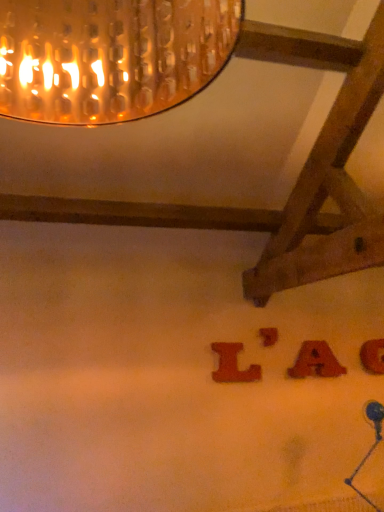
Question: Is wooden letter at center, which appears as the 2th alphabet when viewed from the left, with wooden letter l at center, which ranks as the 1th alphabet in left-to-right order?

Choices:
 (A) yes
 (B) no

Answer: (B)

Question: Is wooden letter at center, which appears as the 2th alphabet when viewed from the left, taller than wooden letter l at center, the 4th alphabet in the right-to-left sequence?

Choices:
 (A) no
 (B) yes

Answer: (A)

Question: Does wooden letter at center, the 3th alphabet positioned from the right, lie in front of wooden letter l at center, which ranks as the 1th alphabet in left-to-right order?

Choices:
 (A) no
 (B) yes

Answer: (A)

Question: Can you confirm if wooden letter at center, which appears as the 2th alphabet when viewed from the left, is positioned to the left of wooden letter l at center, which ranks as the 1th alphabet in left-to-right order?

Choices:
 (A) no
 (B) yes

Answer: (A)

Question: From the image's perspective, does wooden letter at center, the 3th alphabet positioned from the right, appear lower than wooden letter l at center, which ranks as the 1th alphabet in left-to-right order?

Choices:
 (A) yes
 (B) no

Answer: (B)

Question: In terms of width, does wooden letter at lower right, the 1th alphabet from the right, look wider or thinner when compared to wooden letter at center, the 3th alphabet positioned from the right?

Choices:
 (A) thin
 (B) wide

Answer: (B)

Question: Visually, is wooden letter at lower right, the 1th alphabet from the right, positioned to the left or to the right of wooden letter at center, the 3th alphabet positioned from the right?

Choices:
 (A) right
 (B) left

Answer: (A)

Question: Considering the positions of wooden letter at lower right, the 1th alphabet from the right, and wooden letter at center, the 3th alphabet positioned from the right, in the image, is wooden letter at lower right, the 1th alphabet from the right, bigger or smaller than wooden letter at center, the 3th alphabet positioned from the right,?

Choices:
 (A) big
 (B) small

Answer: (A)

Question: From the image's perspective, is wooden letter at lower right, the 1th alphabet from the right, located above or below wooden letter at center, which appears as the 2th alphabet when viewed from the left?

Choices:
 (A) above
 (B) below

Answer: (B)

Question: Is wooden letter at center, the 3th alphabet positioned from the right, wider or thinner than wooden letter at lower right, the 1th alphabet from the right?

Choices:
 (A) thin
 (B) wide

Answer: (A)

Question: Is wooden letter at center, the 3th alphabet positioned from the right, bigger or smaller than wooden letter at lower right, the 4th alphabet when ordered from left to right?

Choices:
 (A) big
 (B) small

Answer: (B)

Question: From the image's perspective, is wooden letter at center, the 3th alphabet positioned from the right, located above or below wooden letter at lower right, the 4th alphabet when ordered from left to right?

Choices:
 (A) above
 (B) below

Answer: (A)

Question: Is point (273, 344) closer or farther from the camera than point (375, 360)?

Choices:
 (A) farther
 (B) closer

Answer: (B)

Question: Is matte wooden letter a at lower right, which is the third alphabet from left to right, taller or shorter than wooden letter l at center, which ranks as the 1th alphabet in left-to-right order?

Choices:
 (A) short
 (B) tall

Answer: (A)

Question: From a real-world perspective, is matte wooden letter a at lower right, which is the third alphabet from left to right, physically located above or below wooden letter l at center, which ranks as the 1th alphabet in left-to-right order?

Choices:
 (A) above
 (B) below

Answer: (B)